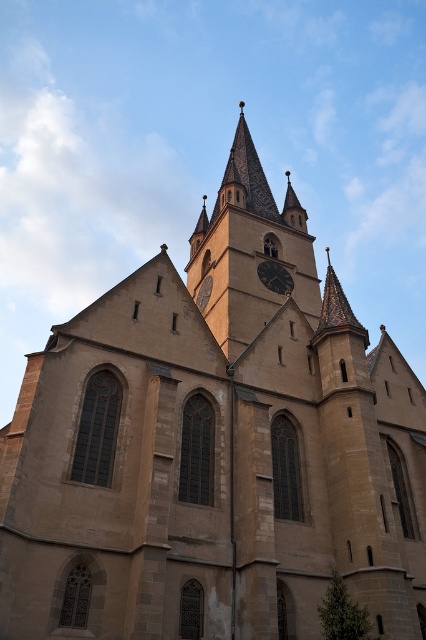
Is brown stone clock tower at center thinner than dark brown wooden clock at center?

No.

Is brown stone clock tower at center further to camera compared to dark brown wooden clock at center?

No, brown stone clock tower at center is closer to the viewer.

You are a GUI agent. You are given a task and a screenshot of the screen. Output one action in this format:
    pyautogui.click(x=<x>, y=<y>)
    Task: Click on the brown stone clock tower at center
    
    Given the screenshot: What is the action you would take?
    pyautogui.click(x=250, y=250)

Can you confirm if dark brown wooden clock at center is bigger than dark brown stone clock at center?

Yes.

Can you confirm if dark brown wooden clock at center is wider than dark brown stone clock at center?

Indeed, dark brown wooden clock at center has a greater width compared to dark brown stone clock at center.

Find the location of a particular element. Image resolution: width=426 pixels, height=640 pixels. dark brown wooden clock at center is located at coordinates (275, 276).

At what (x,y) coordinates should I click in order to perform the action: click on dark brown wooden clock at center. Please return your answer as a coordinate pair (x, y). The image size is (426, 640). Looking at the image, I should click on (275, 276).

Is point (236, 348) positioned behind point (198, 301)?

No, it is not.

Who is lower down, brown stone clock tower at center or dark brown stone clock at center?

dark brown stone clock at center

Is point (299, 218) positioned in front of point (207, 278)?

No, it is behind (207, 278).

Locate an element on the screen. Image resolution: width=426 pixels, height=640 pixels. brown stone clock tower at center is located at coordinates (250, 250).